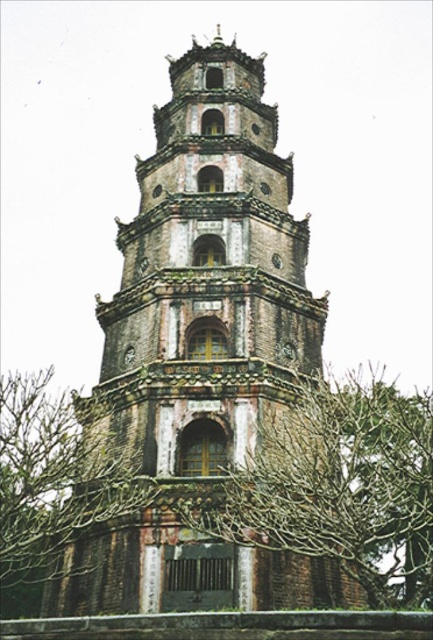
Question: Is brown leafless branches at center to the left of brown textured tree at lower left from the viewer's perspective?

Choices:
 (A) no
 (B) yes

Answer: (A)

Question: Is brown stone tower at center in front of brown textured tree at lower left?

Choices:
 (A) no
 (B) yes

Answer: (A)

Question: Can you confirm if brown leafless branches at center is positioned to the left of brown textured tree at lower left?

Choices:
 (A) no
 (B) yes

Answer: (A)

Question: Which of the following is the farthest from the observer?

Choices:
 (A) brown leafless branches at center
 (B) brown stone tower at center

Answer: (B)

Question: Which point is farther to the camera?

Choices:
 (A) (384, 401)
 (B) (96, 589)

Answer: (A)

Question: Which point appears closest to the camera in this image?

Choices:
 (A) (145, 349)
 (B) (348, 432)
 (C) (5, 496)

Answer: (C)